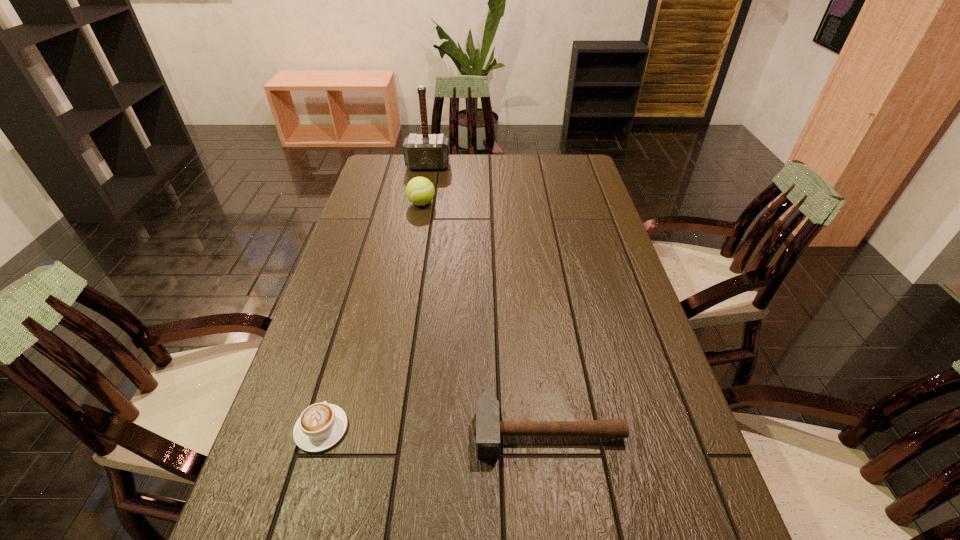
At what (x,y) coordinates should I click in order to perform the action: click on vacant position located with the handle on the right side of the shortest object. Please return your answer as a coordinate pair (x, y). Looking at the image, I should click on [363, 285].

Identify the location of free location located with the handle on the right side of the shortest object. tap(348, 338).

Locate an element on the screen. This screenshot has height=540, width=960. vacant position located with the handle on the right side of the shortest object is located at coordinates (354, 315).

Locate an element on the screen. object located in the far edge section of the desktop is located at coordinates (425, 151).

Where is `hammer that is at the left edge`? This screenshot has width=960, height=540. hammer that is at the left edge is located at coordinates (425, 151).

Find the location of `cappuccino situated at the left edge`. cappuccino situated at the left edge is located at coordinates (320, 426).

This screenshot has width=960, height=540. I want to click on object that is at the right edge, so click(488, 428).

Locate an element on the screen. object that is positioned at the far left corner is located at coordinates (425, 151).

Find the location of a particular element. free space at the far edge of the desktop is located at coordinates (518, 176).

This screenshot has height=540, width=960. In the image, there is a desktop. Find the location of `vacant space at the left edge`. vacant space at the left edge is located at coordinates (285, 530).